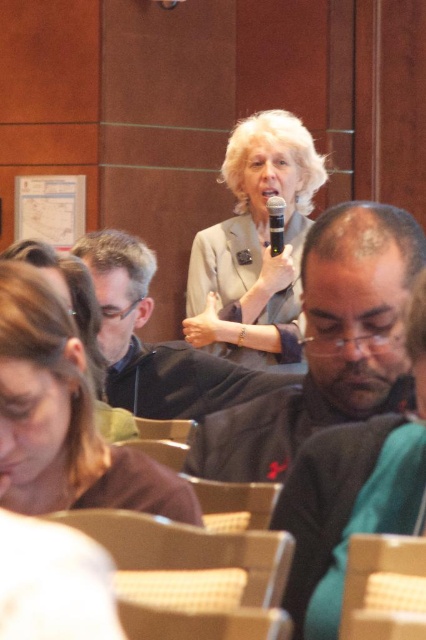
From the picture: Is matte black suit at center shorter than silver metallic microphone at center?

In fact, matte black suit at center may be taller than silver metallic microphone at center.

Is matte black suit at center positioned behind silver metallic microphone at center?

That is False.

Does point (379, 310) lie behind point (281, 248)?

No, it is in front of (281, 248).

Image resolution: width=426 pixels, height=640 pixels. I want to click on matte black suit at center, so click(327, 346).

Between matte black hair at lower left and light gray suit at center, which one is positioned lower?

matte black hair at lower left is lower down.

Who is shorter, matte black hair at lower left or light gray suit at center?

With less height is matte black hair at lower left.

Who is more forward, (126,458) or (218,243)?

Positioned in front is point (126,458).

Identify the location of matte black hair at lower left. This screenshot has height=640, width=426. (x=63, y=417).

Does matte black hair at lower left have a greater height compared to matte black jacket at center?

Incorrect, matte black hair at lower left's height is not larger of matte black jacket at center's.

Is matte black hair at lower left in front of matte black jacket at center?

Yes, it is.

Between point (32, 515) and point (268, 374), which one is positioned behind?

Positioned behind is point (268, 374).

This screenshot has height=640, width=426. In order to click on matte black hair at lower left in this screenshot , I will do `click(63, 417)`.